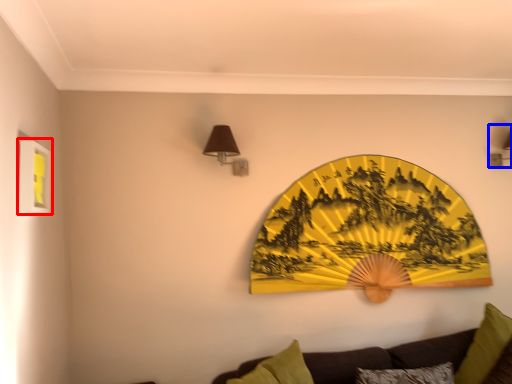
Question: Which of the following is the closest to the observer, picture frame (highlighted by a red box) or lamp (highlighted by a blue box)?

Choices:
 (A) picture frame
 (B) lamp

Answer: (A)